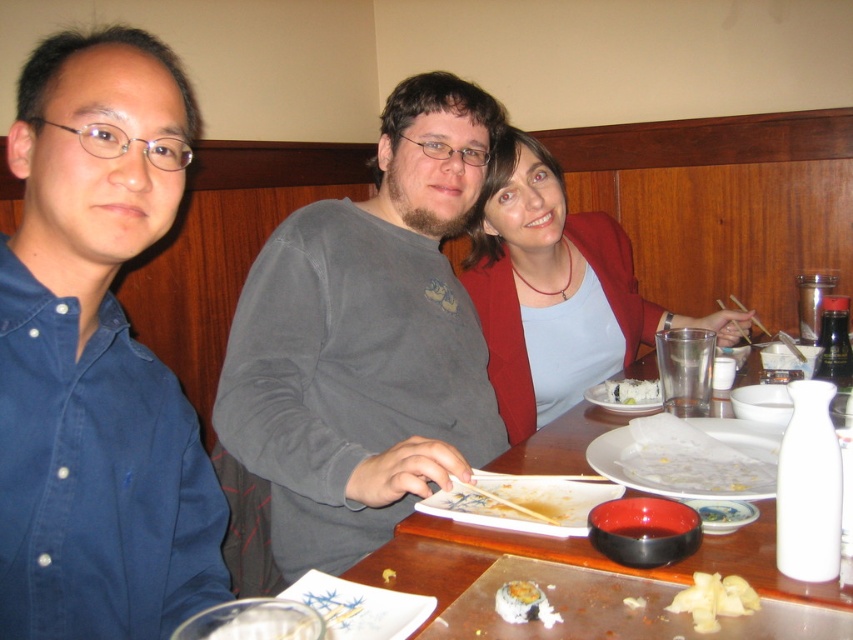
Is transparent paper plate at center below shiny white sushi at center?

Actually, transparent paper plate at center is above shiny white sushi at center.

What do you see at coordinates (689, 458) in the screenshot?
I see `transparent paper plate at center` at bounding box center [689, 458].

The height and width of the screenshot is (640, 853). Identify the location of transparent paper plate at center. (689, 458).

Does white glossy plate at center appear on the left side of white soft potato at lower center?

Correct, you'll find white glossy plate at center to the left of white soft potato at lower center.

Is point (444, 504) behind point (701, 580)?

Yes.

The image size is (853, 640). What do you see at coordinates (523, 500) in the screenshot?
I see `white glossy plate at center` at bounding box center [523, 500].

Locate an element on the screen. This screenshot has width=853, height=640. white glossy plate at center is located at coordinates (523, 500).

Is point (509, 508) less distant than point (648, 394)?

Yes, point (509, 508) is closer to viewer.

Which of these two, white glossy plate at center or white matte sushi at center, stands taller?

With more height is white glossy plate at center.

Image resolution: width=853 pixels, height=640 pixels. I want to click on white glossy plate at center, so pos(523,500).

Locate an element on the screen. This screenshot has height=640, width=853. white glossy plate at center is located at coordinates (523, 500).